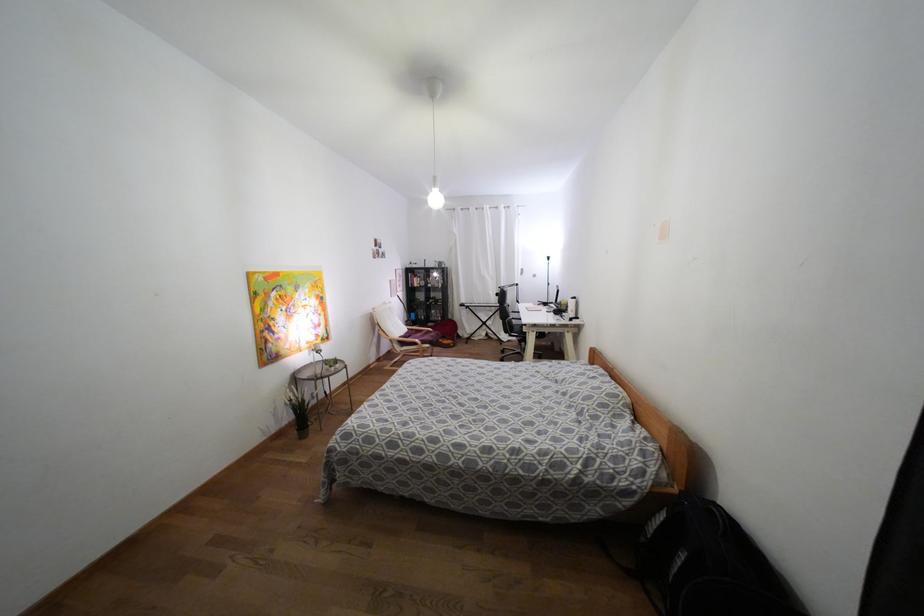
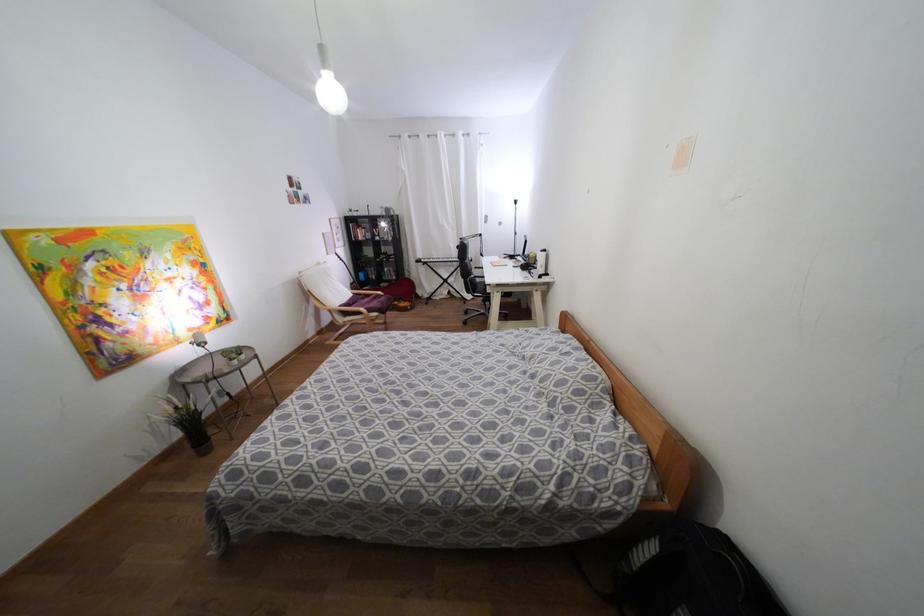
Question: The images are taken continuously from a first-person perspective. In which direction are you moving?

Choices:
 (A) Left
 (B) Right
 (C) Forward
 (D) Backward

Answer: (C)